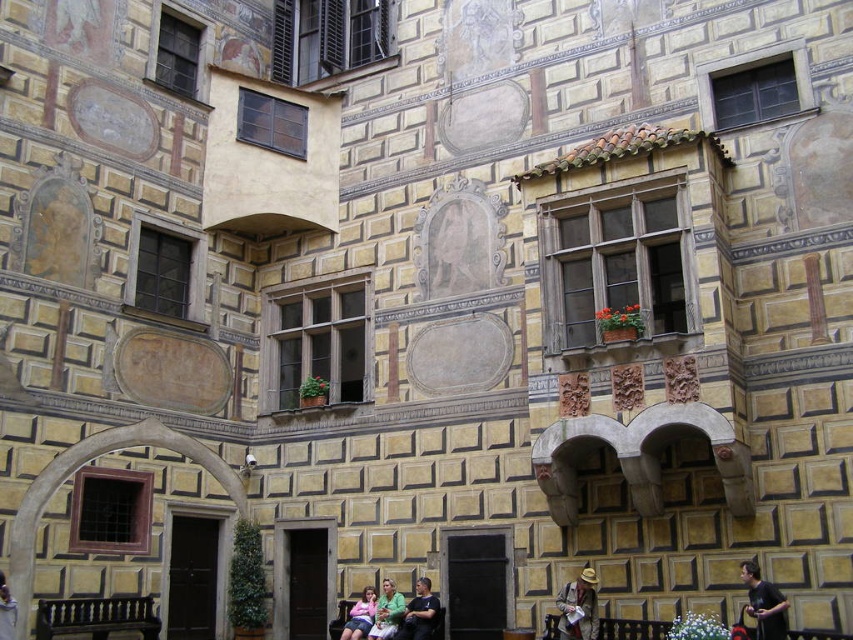
Question: Which object is farther from the camera taking this photo?

Choices:
 (A) green fabric dress at lower center
 (B) leather hat at center
 (C) matte black shirt at center

Answer: (A)

Question: Does green fabric dress at lower center have a smaller size compared to matte pink dress at lower center?

Choices:
 (A) yes
 (B) no

Answer: (B)

Question: Does leather hat at center appear on the left side of wooden park bench at lower center?

Choices:
 (A) yes
 (B) no

Answer: (B)

Question: Is leather hat at center smaller than wooden park bench at lower center?

Choices:
 (A) yes
 (B) no

Answer: (A)

Question: Which object is farther from the camera taking this photo?

Choices:
 (A) wooden park bench at lower center
 (B) matte black shirt at center

Answer: (A)

Question: Which object is the farthest from the wooden park bench at lower center?

Choices:
 (A) leather hat at center
 (B) black fabric shirt at lower right

Answer: (B)